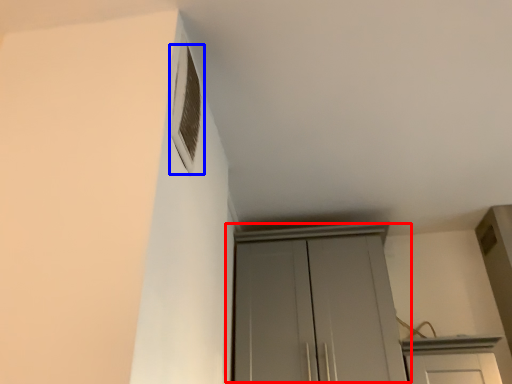
Question: Which object is further to the camera taking this photo, cupboard (highlighted by a red box) or window (highlighted by a blue box)?

Choices:
 (A) cupboard
 (B) window

Answer: (A)